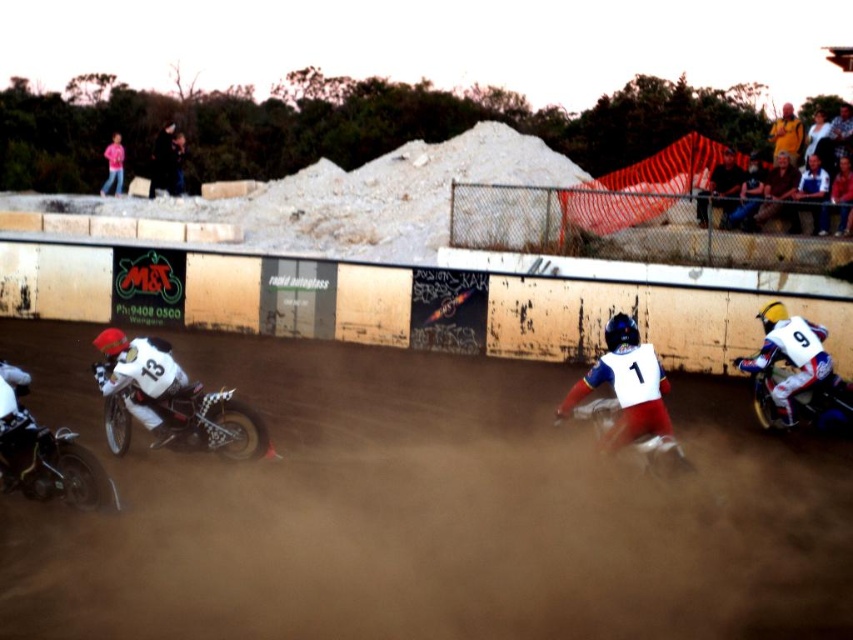
Question: Which point is closer to the camera?

Choices:
 (A) yellow jersey at upper right
 (B) shiny chrome motorcycle at lower left
 (C) white glossy motorbike at center
 (D) pink fabric at upper left

Answer: (B)

Question: Can you confirm if shiny chrome motorcycle at lower left is bigger than yellow jersey at upper right?

Choices:
 (A) no
 (B) yes

Answer: (A)

Question: Which of the following is the closest to the observer?

Choices:
 (A) (209, 422)
 (B) (842, 396)

Answer: (A)

Question: Considering the real-world distances, which object is farthest from the pink fabric at upper left?

Choices:
 (A) white glossy motorbike at center
 (B) shiny chrome motorcycle at lower left

Answer: (A)

Question: Can you confirm if brushed metal motorcycle at left is bigger than pink fabric at upper left?

Choices:
 (A) no
 (B) yes

Answer: (A)

Question: Observing the image, what is the correct spatial positioning of yellow jersey at upper right in reference to pink fabric at upper left?

Choices:
 (A) above
 (B) below

Answer: (B)